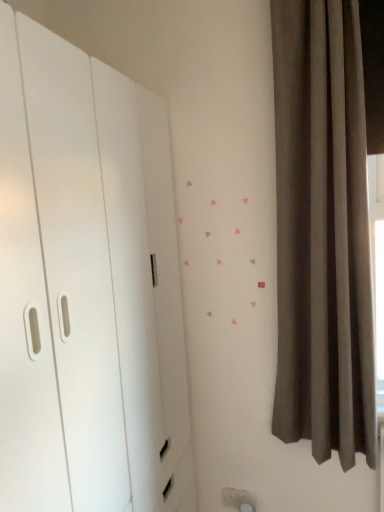
The height and width of the screenshot is (512, 384). What do you see at coordinates (87, 286) in the screenshot?
I see `white matte dresser at left` at bounding box center [87, 286].

The image size is (384, 512). I want to click on white matte dresser at left, so (87, 286).

What is the approximate height of white matte dresser at left?

It is 6.12 feet.

Describe the element at coordinates (322, 232) in the screenshot. Image resolution: width=384 pixels, height=512 pixels. I see `dark gray velvet curtain at right` at that location.

This screenshot has height=512, width=384. Find the location of `dark gray velvet curtain at right`. dark gray velvet curtain at right is located at coordinates (322, 232).

I want to click on white matte dresser at left, so click(x=87, y=286).

Does dark gray velvet curtain at right appear on the right side of white matte dresser at left?

Indeed, dark gray velvet curtain at right is positioned on the right side of white matte dresser at left.

Is dark gray velvet curtain at right in front of or behind white matte dresser at left in the image?

dark gray velvet curtain at right is positioned farther from the viewer than white matte dresser at left.

Does point (306, 201) appear closer or farther from the camera than point (126, 99)?

Point (306, 201) is farther from the camera than point (126, 99).

From the image's perspective, does dark gray velvet curtain at right appear higher than white matte dresser at left?

Yes, from the image's perspective, dark gray velvet curtain at right is above white matte dresser at left.

From a real-world perspective, is dark gray velvet curtain at right positioned over white matte dresser at left based on gravity?

Yes, from a real-world perspective, dark gray velvet curtain at right is above white matte dresser at left.

Considering the relative sizes of dark gray velvet curtain at right and white matte dresser at left in the image provided, is dark gray velvet curtain at right wider than white matte dresser at left?

In fact, dark gray velvet curtain at right might be narrower than white matte dresser at left.

Considering the sizes of objects dark gray velvet curtain at right and white matte dresser at left in the image provided, who is shorter, dark gray velvet curtain at right or white matte dresser at left?

dark gray velvet curtain at right.

Which of these two, dark gray velvet curtain at right or white matte dresser at left, is smaller?

dark gray velvet curtain at right.

Is white matte dresser at left surrounded by dark gray velvet curtain at right?

Definitely not — white matte dresser at left is not inside dark gray velvet curtain at right.

Is the surface of dark gray velvet curtain at right in direct contact with white matte dresser at left?

No, dark gray velvet curtain at right is not making contact with white matte dresser at left.

Could you tell me if dark gray velvet curtain at right is turned towards white matte dresser at left?

No, dark gray velvet curtain at right does not turn towards white matte dresser at left.

How many degrees apart are the facing directions of dark gray velvet curtain at right and white matte dresser at left?

90.3 degrees.

Where is `dresser beneath the dark gray velvet curtain at right (from a real-world perspective)`? Image resolution: width=384 pixels, height=512 pixels. dresser beneath the dark gray velvet curtain at right (from a real-world perspective) is located at coordinates (87, 286).

Which is more to the left, white matte dresser at left or dark gray velvet curtain at right?

From the viewer's perspective, white matte dresser at left appears more on the left side.

Is white matte dresser at left closer to camera compared to dark gray velvet curtain at right?

Yes, white matte dresser at left is closer to the viewer.

Between point (142, 337) and point (314, 71), which one is positioned behind?

The point (314, 71) is farther from the camera.

From the image's perspective, is white matte dresser at left on top of dark gray velvet curtain at right?

Incorrect, from the image's perspective, white matte dresser at left is lower than dark gray velvet curtain at right.

From a real-world perspective, is white matte dresser at left positioned above or below dark gray velvet curtain at right?

white matte dresser at left is situated lower than dark gray velvet curtain at right in the real world.

Can you confirm if white matte dresser at left is thinner than dark gray velvet curtain at right?

Incorrect, the width of white matte dresser at left is not less than that of dark gray velvet curtain at right.

In the scene shown: Which of these two, white matte dresser at left or dark gray velvet curtain at right, stands shorter?

With less height is dark gray velvet curtain at right.

Considering the relative sizes of white matte dresser at left and dark gray velvet curtain at right in the image provided, is white matte dresser at left bigger than dark gray velvet curtain at right?

Yes, white matte dresser at left is bigger than dark gray velvet curtain at right.

Is dark gray velvet curtain at right surrounded by white matte dresser at left?

Definitely not — dark gray velvet curtain at right is not inside white matte dresser at left.

Is white matte dresser at left touching dark gray velvet curtain at right?

No, white matte dresser at left is not making contact with dark gray velvet curtain at right.

Is white matte dresser at left facing away from dark gray velvet curtain at right?

No.

From the picture: What's the angular difference between white matte dresser at left and dark gray velvet curtain at right's facing directions?

There is a 90.3-degree angle between the facing directions of white matte dresser at left and dark gray velvet curtain at right.

The width and height of the screenshot is (384, 512). In order to click on curtain above the white matte dresser at left (from the image's perspective) in this screenshot , I will do `click(322, 232)`.

The height and width of the screenshot is (512, 384). I want to click on dresser in front of the dark gray velvet curtain at right, so click(x=87, y=286).

I want to click on dresser that is below the dark gray velvet curtain at right (from the image's perspective), so click(x=87, y=286).